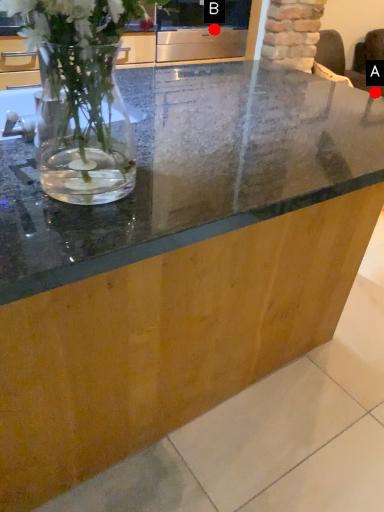
Question: Two points are circled on the image, labeled by A and B beside each circle. Which point is further to the camera?

Choices:
 (A) A is further
 (B) B is further

Answer: (A)